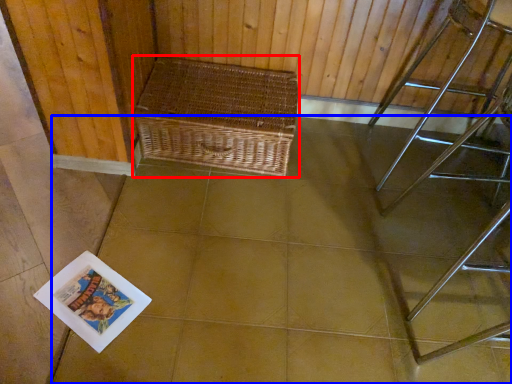
Question: Among these objects, which one is nearest to the camera, picnic basket (highlighted by a red box) or square (highlighted by a blue box)?

Choices:
 (A) picnic basket
 (B) square

Answer: (B)